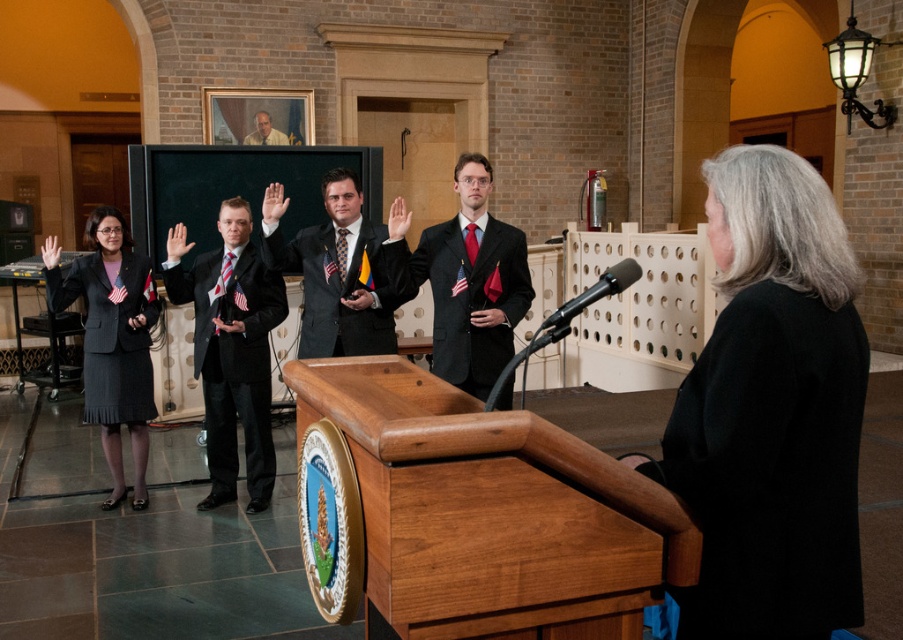
Question: Which object appears closest to the camera in this image?

Choices:
 (A) matte black suit at center
 (B) black satin business suit at center
 (C) matte black suit at left

Answer: (A)

Question: Can you confirm if black satin business suit at center is positioned below matte black suit at center?

Choices:
 (A) yes
 (B) no

Answer: (A)

Question: Does shiny black suit at center appear under black metallic microphone at center?

Choices:
 (A) no
 (B) yes

Answer: (A)

Question: Which of these objects is positioned farthest from the matte black suit at left?

Choices:
 (A) matte black suit at upper center
 (B) black metallic microphone at center
 (C) black wool business suit at center
 (D) shiny black suit at center

Answer: (C)

Question: Which object is farther from the camera taking this photo?

Choices:
 (A) matte black suit at left
 (B) shiny black suit at center
 (C) black satin business suit at center

Answer: (C)

Question: Is black wool business suit at center positioned at the back of matte black suit at center?

Choices:
 (A) no
 (B) yes

Answer: (A)